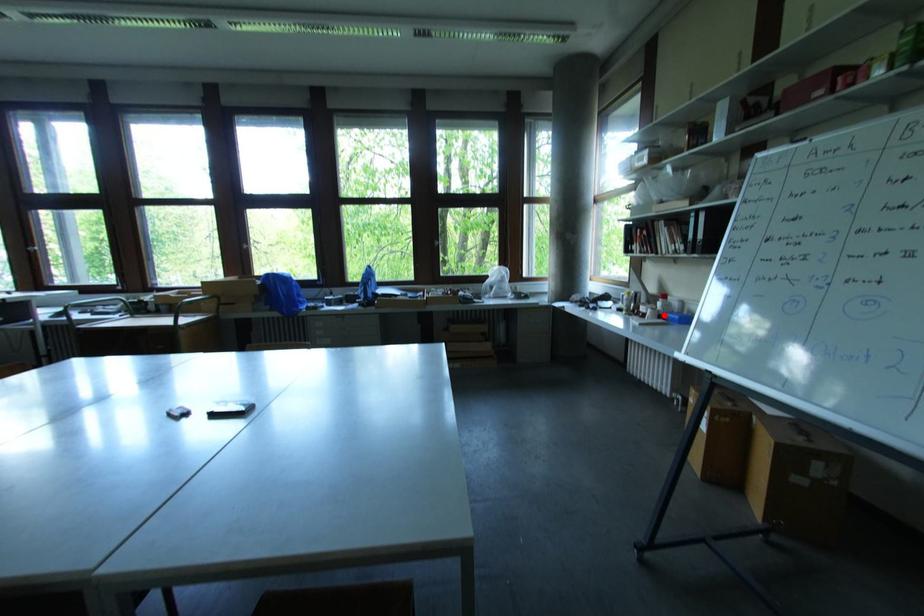
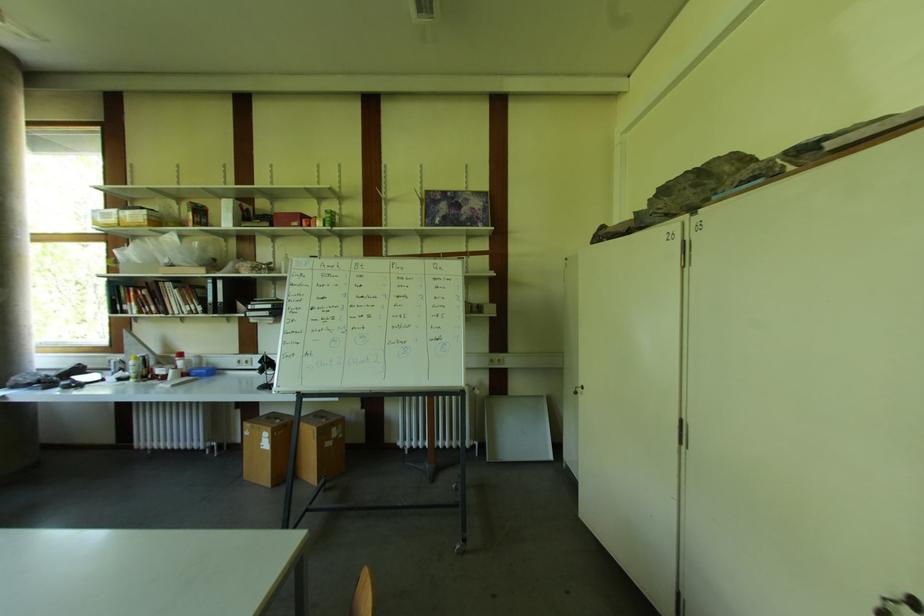
Question: I am providing you with two images of the same scene from different viewpoints. A red point is marked on the first image. Is the red point's position out of view in image 2?

Choices:
 (A) Yes
 (B) No

Answer: (B)